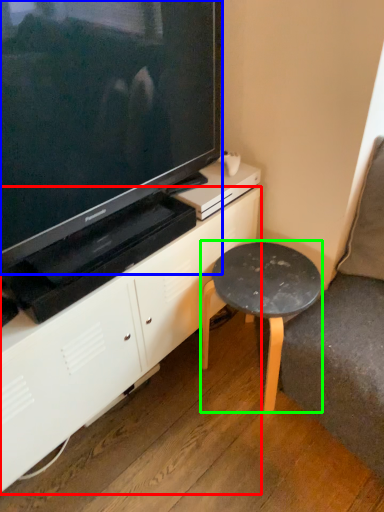
Question: Estimate the real-world distances between objects in this image. Which object is farther from cabinetry (highlighted by a red box), television (highlighted by a blue box) or stool (highlighted by a green box)?

Choices:
 (A) television
 (B) stool

Answer: (A)